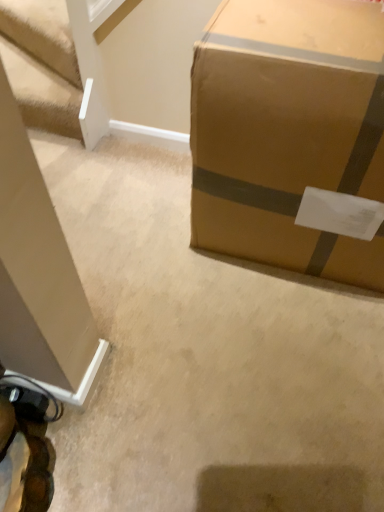
Question: Is white textured stairwell at upper left shorter than brown cardboard box at right?

Choices:
 (A) no
 (B) yes

Answer: (B)

Question: Is white textured stairwell at upper left turned away from brown cardboard box at right?

Choices:
 (A) no
 (B) yes

Answer: (A)

Question: Is white textured stairwell at upper left to the left of brown cardboard box at right from the viewer's perspective?

Choices:
 (A) no
 (B) yes

Answer: (B)

Question: From the image's perspective, is white textured stairwell at upper left beneath brown cardboard box at right?

Choices:
 (A) no
 (B) yes

Answer: (A)

Question: Does white textured stairwell at upper left come behind brown cardboard box at right?

Choices:
 (A) no
 (B) yes

Answer: (B)

Question: Is white textured stairwell at upper left positioned far away from brown cardboard box at right?

Choices:
 (A) yes
 (B) no

Answer: (B)

Question: Does brown cardboard box at right have a larger size compared to white textured stairwell at upper left?

Choices:
 (A) yes
 (B) no

Answer: (A)

Question: Is white textured stairwell at upper left a part of brown cardboard box at right?

Choices:
 (A) no
 (B) yes

Answer: (A)

Question: Is brown cardboard box at right at the right side of white textured stairwell at upper left?

Choices:
 (A) yes
 (B) no

Answer: (A)

Question: From a real-world perspective, is brown cardboard box at right under white textured stairwell at upper left?

Choices:
 (A) no
 (B) yes

Answer: (A)

Question: Is brown cardboard box at right not near white textured stairwell at upper left?

Choices:
 (A) no
 (B) yes

Answer: (A)

Question: Is brown cardboard box at right shorter than white textured stairwell at upper left?

Choices:
 (A) yes
 (B) no

Answer: (B)

Question: From a real-world perspective, is brown cardboard box at right physically located above or below white textured stairwell at upper left?

Choices:
 (A) below
 (B) above

Answer: (B)